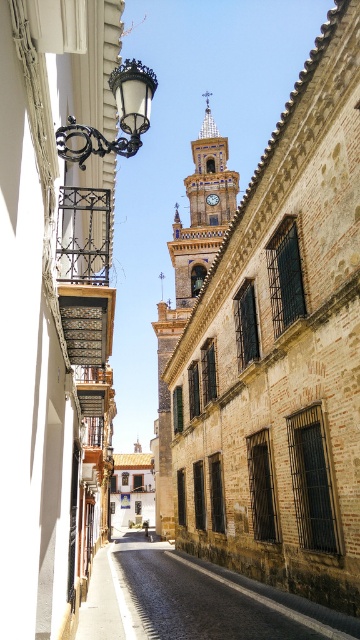
Question: Can you confirm if golden brick church at center is wider than golden stone clock tower at center?

Choices:
 (A) no
 (B) yes

Answer: (B)

Question: Can you confirm if golden brick church at center is positioned below golden stone clock tower at center?

Choices:
 (A) no
 (B) yes

Answer: (B)

Question: Which point appears closest to the camera in this image?

Choices:
 (A) (204, 92)
 (B) (262, 598)

Answer: (B)

Question: In this image, where is yellow brick tower at center located relative to matte gray clock at center?

Choices:
 (A) right
 (B) left

Answer: (B)

Question: Based on their relative distances, which object is farther from the golden brick church at center?

Choices:
 (A) yellow brick tower at center
 (B) cobblestone street at center

Answer: (B)

Question: Which object appears farthest from the camera in this image?

Choices:
 (A) matte gray clock at center
 (B) yellow brick tower at center
 (C) black wrought iron streetlamp at upper left
 (D) golden stone clock tower at center

Answer: (A)